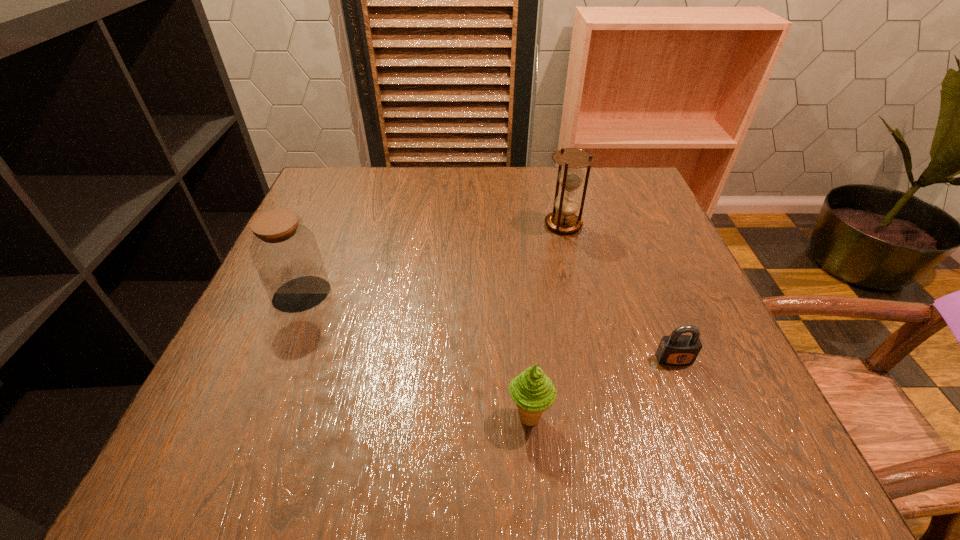
Locate an element on the screen. The height and width of the screenshot is (540, 960). blank area located 0.090m on the back of the second shortest object is located at coordinates (523, 353).

Find the location of a particular element. This screenshot has height=540, width=960. vacant area situated on the front of the third farthest object near the keyhole is located at coordinates (720, 476).

I want to click on object present at the far edge, so pos(563,219).

Find the location of `object located in the near edge section of the desktop`. object located in the near edge section of the desktop is located at coordinates (533, 392).

Where is `object that is at the left edge`? object that is at the left edge is located at coordinates (285, 253).

Locate an element on the screen. Image resolution: width=960 pixels, height=540 pixels. object that is positioned at the right edge is located at coordinates (674, 350).

In the image, there is a desktop. Where is `vacant region at the far edge`? Image resolution: width=960 pixels, height=540 pixels. vacant region at the far edge is located at coordinates point(479,188).

In the image, there is a desktop. Identify the location of vacant space at the near edge. (415, 424).

In order to click on vacant space at the left edge in this screenshot , I will do `click(265, 404)`.

Identify the location of vacant space at the right edge of the desktop. The height and width of the screenshot is (540, 960). click(x=684, y=280).